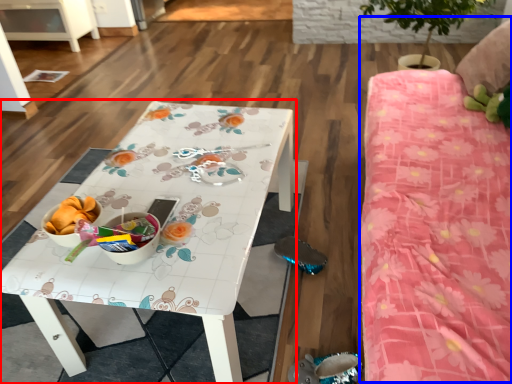
Question: Which object is further to the camera taking this photo, table (highlighted by a red box) or bed (highlighted by a blue box)?

Choices:
 (A) table
 (B) bed

Answer: (A)